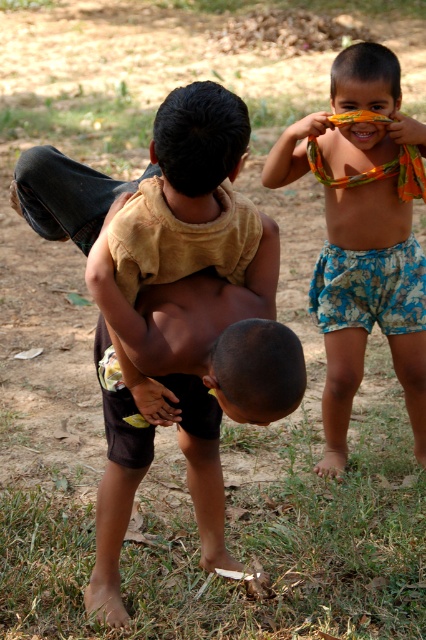
You are a photographer trying to capture a photo of the two boys in the scene. You want to ensure both the brown cotton shirt at center and the floral shorts at right are clearly visible. Based on their positions, which clothing item is closer to the camera?

The brown cotton shirt at center is closer to the camera because it is in front of the floral shorts at right.

In the scene shown: You are a photographer trying to capture a candid shot of the two boys. You notice the floral shorts at right and the brown matte nose at center. Which object should you focus on first if you want to capture the boy being lifted?

The brown matte nose at center is closer to the photographer, so focusing on it first will ensure the boy being lifted is in clear focus.